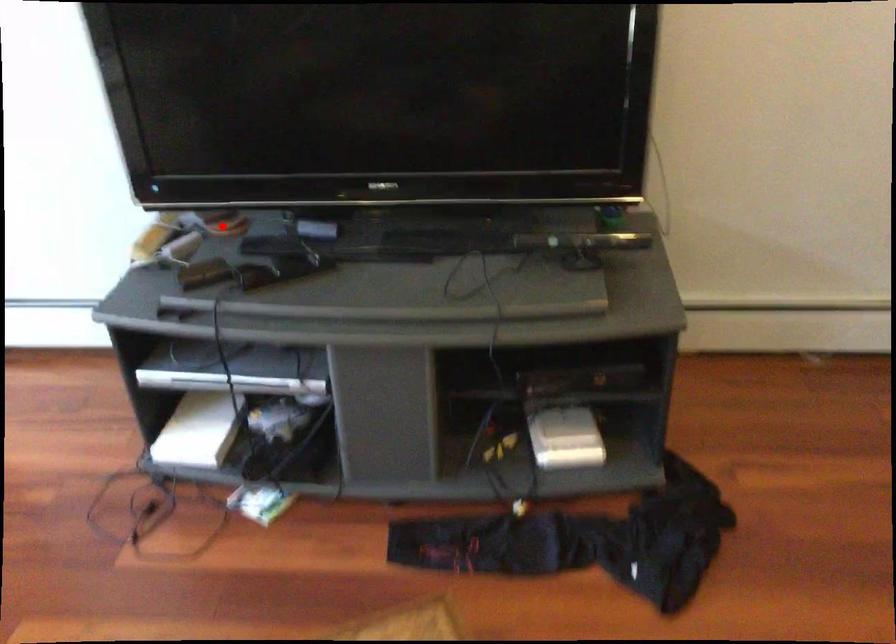
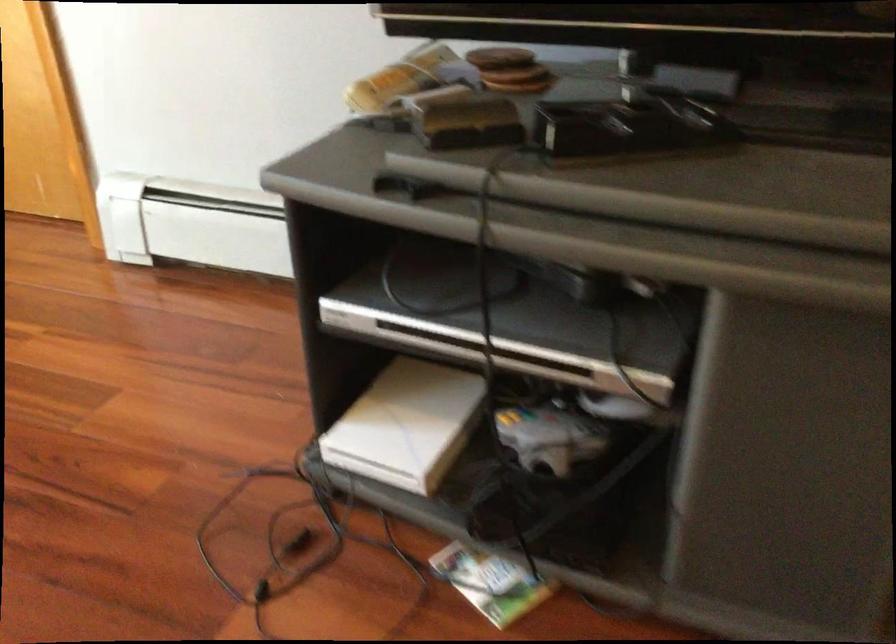
Question: A red point is marked in image1. In image2, is the corresponding 3D point closer to the camera or farther? Reply with the corresponding letter.

Choices:
 (A) The corresponding 3D point is closer.
 (B) The corresponding 3D point is farther.

Answer: (A)